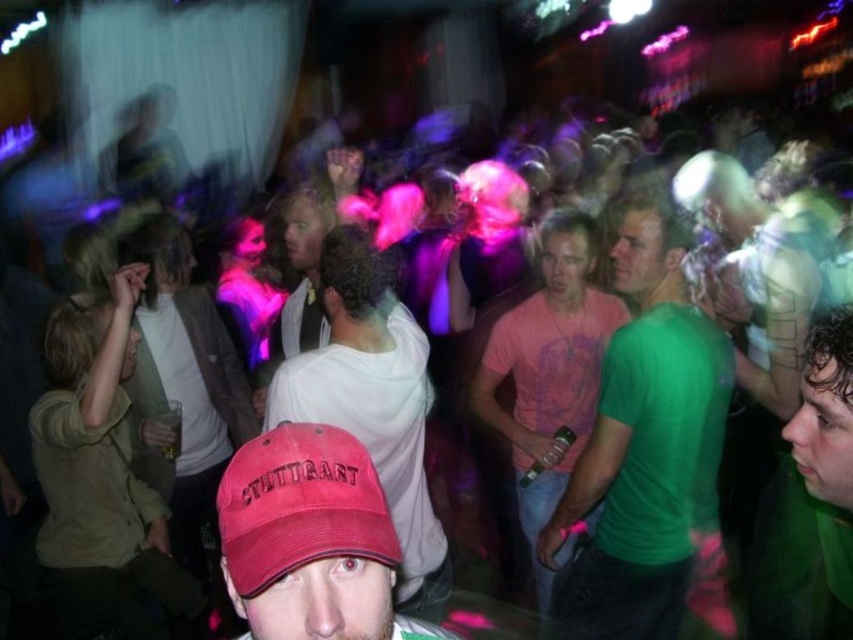
You are a photographer at the nightclub and want to capture a clear photo of the green matte shirt at center and the green matte shirt at right. Since the crowd is moving, you need to know which shirt is in front to focus properly. Can you tell me which one is closer to you?

The green matte shirt at center is positioned over the green matte shirt at right, so the green matte shirt at center is closer to you.